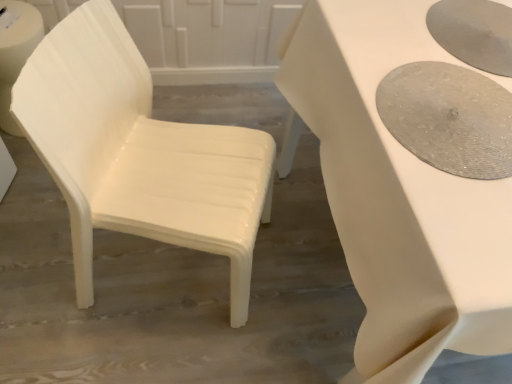
Question: Should I look upward or downward to see white glossy table at center?

Choices:
 (A) down
 (B) up

Answer: (B)

Question: Is white plastic chair at left oriented towards white glossy table at center?

Choices:
 (A) no
 (B) yes

Answer: (B)

Question: Does white plastic chair at left have a greater width compared to white glossy table at center?

Choices:
 (A) no
 (B) yes

Answer: (A)

Question: Is white plastic chair at left surrounding white glossy table at center?

Choices:
 (A) no
 (B) yes

Answer: (A)

Question: Can you confirm if white plastic chair at left is smaller than white glossy table at center?

Choices:
 (A) yes
 (B) no

Answer: (A)

Question: Is white plastic chair at left not near white glossy table at center?

Choices:
 (A) no
 (B) yes

Answer: (A)

Question: From a real-world perspective, is white plastic chair at left positioned under white glossy table at center based on gravity?

Choices:
 (A) no
 (B) yes

Answer: (A)

Question: Does matte silver tray at right come behind white plastic chair at left?

Choices:
 (A) no
 (B) yes

Answer: (B)

Question: Is matte silver tray at right closer to the viewer compared to white plastic chair at left?

Choices:
 (A) yes
 (B) no

Answer: (B)

Question: Is matte silver tray at right next to white plastic chair at left?

Choices:
 (A) yes
 (B) no

Answer: (B)

Question: Does matte silver tray at right appear on the right side of white plastic chair at left?

Choices:
 (A) yes
 (B) no

Answer: (A)

Question: Is matte silver tray at right thinner than white plastic chair at left?

Choices:
 (A) yes
 (B) no

Answer: (A)

Question: Is matte silver tray at right far away from white plastic chair at left?

Choices:
 (A) no
 (B) yes

Answer: (A)

Question: Is white glossy table at center far away from matte silver tray at right?

Choices:
 (A) yes
 (B) no

Answer: (B)